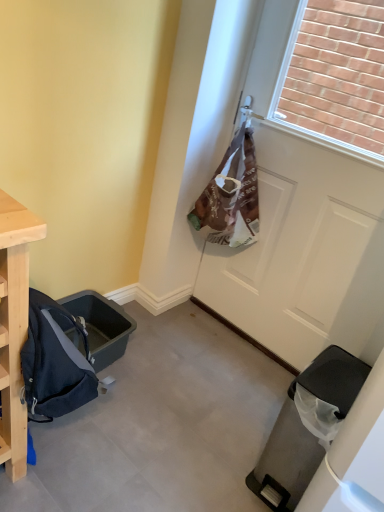
Question: Is white matte door at center to the right of black plastic trash can at lower right from the viewer's perspective?

Choices:
 (A) no
 (B) yes

Answer: (B)

Question: Is black plastic trash can at lower right completely or partially inside white matte door at center?

Choices:
 (A) yes
 (B) no

Answer: (B)

Question: Is the position of white matte door at center less distant than that of black plastic trash can at lower right?

Choices:
 (A) yes
 (B) no

Answer: (B)

Question: Considering the relative positions of white matte door at center and black plastic trash can at lower right in the image provided, is white matte door at center to the left of black plastic trash can at lower right from the viewer's perspective?

Choices:
 (A) no
 (B) yes

Answer: (A)

Question: Is white matte door at center facing away from black plastic trash can at lower right?

Choices:
 (A) no
 (B) yes

Answer: (A)

Question: From a real-world perspective, is white matte door at center over black plastic trash can at lower right?

Choices:
 (A) yes
 (B) no

Answer: (A)

Question: Is black plastic trash can at lower right located outside white matte door at center?

Choices:
 (A) no
 (B) yes

Answer: (B)

Question: Is black plastic trash can at lower right at the right side of white matte door at center?

Choices:
 (A) no
 (B) yes

Answer: (A)

Question: Considering the relative sizes of black plastic trash can at lower right and white matte door at center in the image provided, is black plastic trash can at lower right thinner than white matte door at center?

Choices:
 (A) yes
 (B) no

Answer: (B)

Question: Is black plastic trash can at lower right oriented towards white matte door at center?

Choices:
 (A) no
 (B) yes

Answer: (A)

Question: From a real-world perspective, does black plastic trash can at lower right stand above white matte door at center?

Choices:
 (A) no
 (B) yes

Answer: (A)

Question: Considering the relative positions of black plastic trash can at lower right and white matte door at center in the image provided, is black plastic trash can at lower right behind white matte door at center?

Choices:
 (A) yes
 (B) no

Answer: (B)

Question: From a real-world perspective, is white matte door at center physically located above or below black plastic trash can at lower right?

Choices:
 (A) above
 (B) below

Answer: (A)